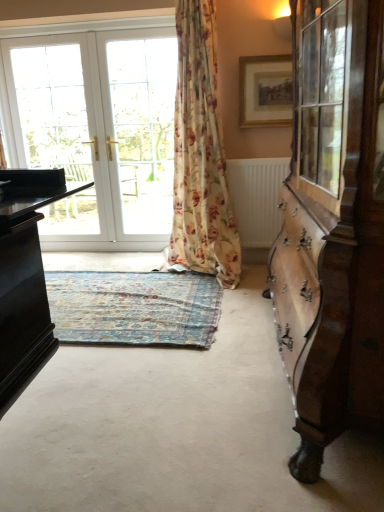
This screenshot has height=512, width=384. What do you see at coordinates (134, 307) in the screenshot? I see `blue floral rug at center` at bounding box center [134, 307].

The width and height of the screenshot is (384, 512). Identify the location of blue floral rug at center. (134, 307).

In order to face white glossy door at upper left, should I rotate leftwards or rightwards?

Turn left by 12.643 degrees to look at white glossy door at upper left.

Describe the element at coordinates (333, 228) in the screenshot. I see `mahogany wood cabinet at right` at that location.

Where is `gold-framed picture at upper center`? This screenshot has height=512, width=384. gold-framed picture at upper center is located at coordinates (265, 91).

Locate an element on the screen. The image size is (384, 512). floral fabric curtain at center is located at coordinates point(200,154).

How far apart are floral fabric curtain at center and blue floral rug at center?

A distance of 29.72 inches exists between floral fabric curtain at center and blue floral rug at center.

From a real-world perspective, is floral fabric curtain at center above or below blue floral rug at center?

floral fabric curtain at center is situated higher than blue floral rug at center in the real world.

Does point (235, 262) appear closer or farther from the camera than point (148, 323)?

Clearly, point (235, 262) is more distant from the camera than point (148, 323).

Locate an element on the screen. mat below the floral fabric curtain at center (from the image's perspective) is located at coordinates (134, 307).

Is gold-framed picture at upper center surrounding blue floral rug at center?

That's incorrect, blue floral rug at center is not inside gold-framed picture at upper center.

Considering the positions of points (265, 112) and (170, 281), is point (265, 112) farther from camera compared to point (170, 281)?

No.

This screenshot has width=384, height=512. In order to click on mat that appears below the gold-framed picture at upper center (from the image's perspective) in this screenshot , I will do `click(134, 307)`.

Measure the distance between gold-framed picture at upper center and blue floral rug at center.

A distance of 5.11 feet exists between gold-framed picture at upper center and blue floral rug at center.

How many degrees apart are the facing directions of white textured radiator at center and floral fabric curtain at center?

They differ by 1.45 degrees in their facing directions.

From a real-world perspective, does white textured radiator at center stand above floral fabric curtain at center?

Actually, white textured radiator at center is physically below floral fabric curtain at center in the real world.

In the scene shown: Measure the distance between white textured radiator at center and floral fabric curtain at center.

white textured radiator at center and floral fabric curtain at center are 12.87 inches apart.

Who is taller, white textured radiator at center or floral fabric curtain at center?

floral fabric curtain at center is taller.

From the image's perspective, is white glossy door at upper left located above or below mahogany wood cabinet at right?

white glossy door at upper left is above mahogany wood cabinet at right.

Where is `cabinetry in front of the white glossy door at upper left`? cabinetry in front of the white glossy door at upper left is located at coordinates (333, 228).

Does white glossy door at upper left come in front of mahogany wood cabinet at right?

No, it is behind mahogany wood cabinet at right.

Considering the sizes of objects white textured radiator at center and white glossy door at upper left in the image provided, who is wider, white textured radiator at center or white glossy door at upper left?

white textured radiator at center.

Is white textured radiator at center facing away from white glossy door at upper left?

That's not correct — white textured radiator at center is not looking away from white glossy door at upper left.

Does blue floral rug at center turn towards white glossy door at upper left?

No, blue floral rug at center is not oriented towards white glossy door at upper left.

Is blue floral rug at center placed right next to white glossy door at upper left?

blue floral rug at center is not next to white glossy door at upper left, and they're not touching.

From a real-world perspective, is blue floral rug at center over white glossy door at upper left?

No, from a real-world perspective, blue floral rug at center is not above white glossy door at upper left.

From the image's perspective, which one is positioned lower, blue floral rug at center or white glossy door at upper left?

blue floral rug at center.

Is blue floral rug at center facing away from mahogany wood cabinet at right?

No, blue floral rug at center is not facing the opposite direction of mahogany wood cabinet at right.

How many degrees apart are the facing directions of blue floral rug at center and mahogany wood cabinet at right?

91.7 degrees.

Is blue floral rug at center placed right next to mahogany wood cabinet at right?

No, blue floral rug at center is not beside mahogany wood cabinet at right.

Is point (117, 334) positioned before point (291, 225)?

No.

In order to click on curtain positioned vertically above the blue floral rug at center (from a real-world perspective) in this screenshot , I will do `click(200, 154)`.

Locate an element on the screen. The width and height of the screenshot is (384, 512). mat to the left of gold-framed picture at upper center is located at coordinates (134, 307).

Based on their spatial positions, is white textured radiator at center or blue floral rug at center further from gold-framed picture at upper center?

blue floral rug at center.

Based on their spatial positions, is blue floral rug at center or white glossy door at upper left closer to white textured radiator at center?

blue floral rug at center lies closer to white textured radiator at center than the other object.

Considering their positions, is white textured radiator at center positioned closer to white glass door at center than mahogany wood cabinet at right?

white textured radiator at center is closer to white glass door at center.

Considering their positions, is white textured radiator at center positioned further to white glossy door at upper left than floral fabric curtain at center?

white textured radiator at center.

Based on their spatial positions, is white textured radiator at center or blue floral rug at center closer to floral fabric curtain at center?

Based on the image, white textured radiator at center appears to be nearer to floral fabric curtain at center.

Considering their positions, is gold-framed picture at upper center positioned closer to mahogany wood cabinet at right than white glossy door at upper left?

The object closer to mahogany wood cabinet at right is gold-framed picture at upper center.

Looking at the image, which one is located further to white glossy door at upper left, white glass door at center or gold-framed picture at upper center?

gold-framed picture at upper center.

Which object lies further to the anchor point mahogany wood cabinet at right, blue floral rug at center or white glass door at center?

white glass door at center.

Locate an element on the screen. The width and height of the screenshot is (384, 512). screen door between white glossy door at upper left and white textured radiator at center from left to right is located at coordinates (140, 128).

This screenshot has height=512, width=384. I want to click on mat between mahogany wood cabinet at right and floral fabric curtain at center from front to back, so click(134, 307).

What are the coordinates of `curtain situated between white glass door at center and gold-framed picture at upper center from left to right` in the screenshot? It's located at (200, 154).

Locate an element on the screen. The height and width of the screenshot is (512, 384). curtain between mahogany wood cabinet at right and white textured radiator at center in the front-back direction is located at coordinates (200, 154).